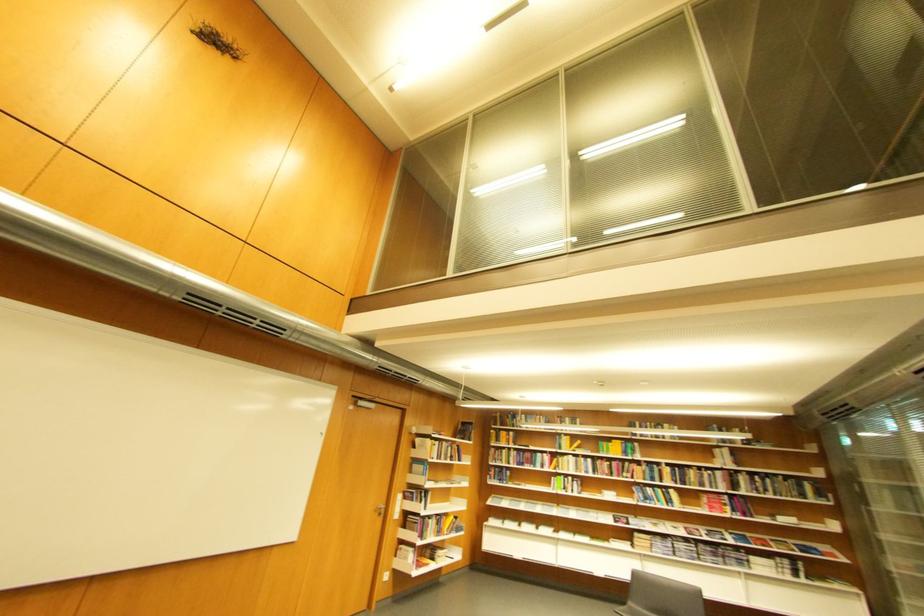
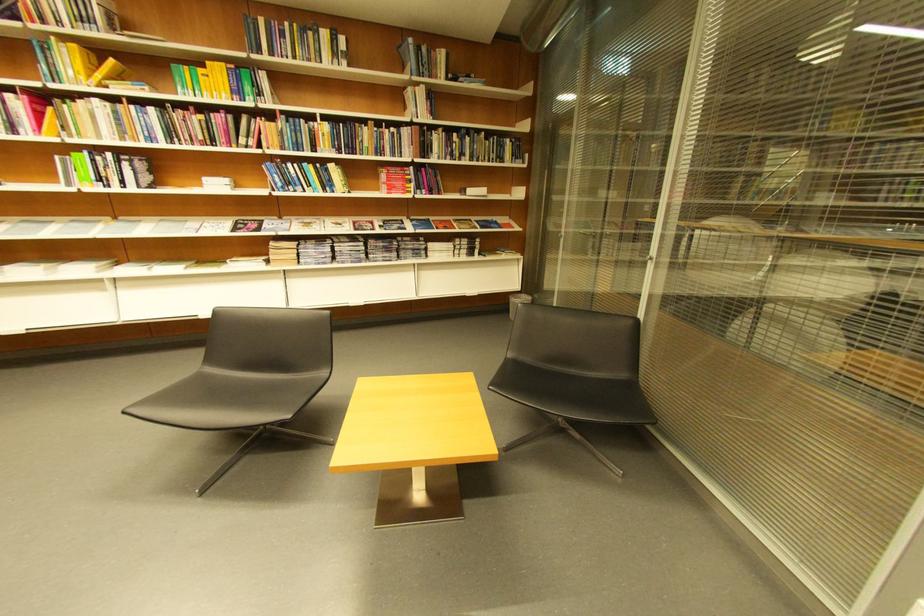
Question: I am providing you with two images of the same scene from different viewpoints. After the viewpoint changes to image2, which objects are now occluded?

Choices:
 (A) magazine
 (B) book
 (C) black chair sitting surface
 (D) none of these

Answer: (D)